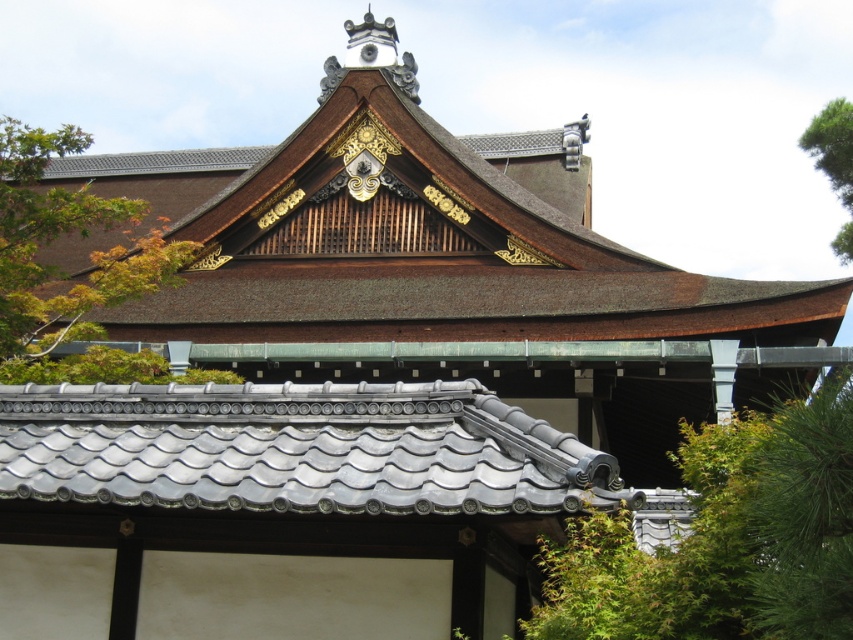
You are standing in front of the traditional Japanese building and notice two green leafy trees framing the structure. Which tree, the green leafy tree at upper left or the green leafy tree at upper right, is taller?

→ The green leafy tree at upper left is taller than the green leafy tree at upper right.

You are an architect examining the traditional Japanese structure. You need to determine which roof section is higher. Based on the image, which one is taller between the brown tile roof at upper center and the gray tile roof at center?

The brown tile roof at upper center is taller than the gray tile roof at center.

You are a photographer planning to capture the traditional Japanese structure. You notice the gray tile roof at center and the green leafy tree at upper right in your frame. Which object appears narrower in the image?

The gray tile roof at center appears narrower than the green leafy tree at upper right in the image.